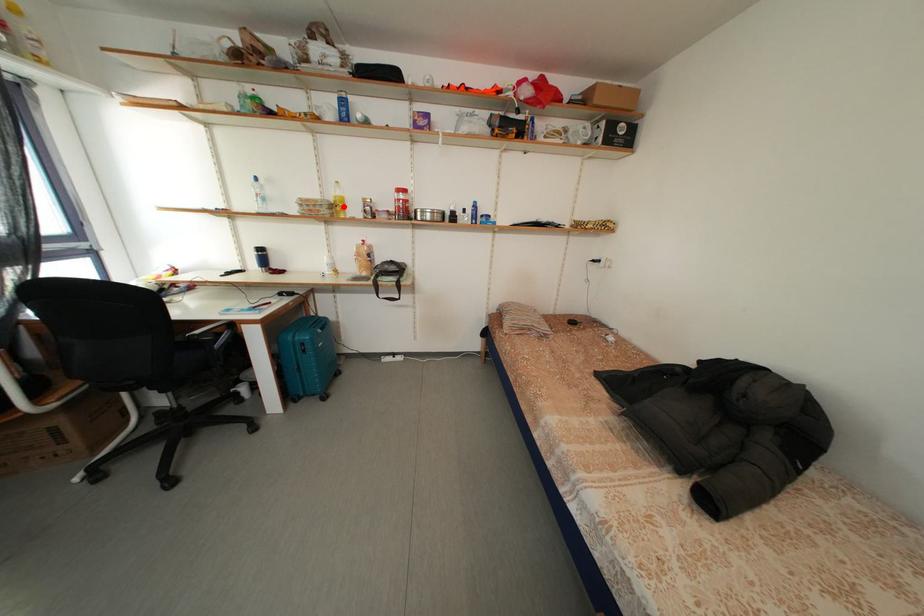
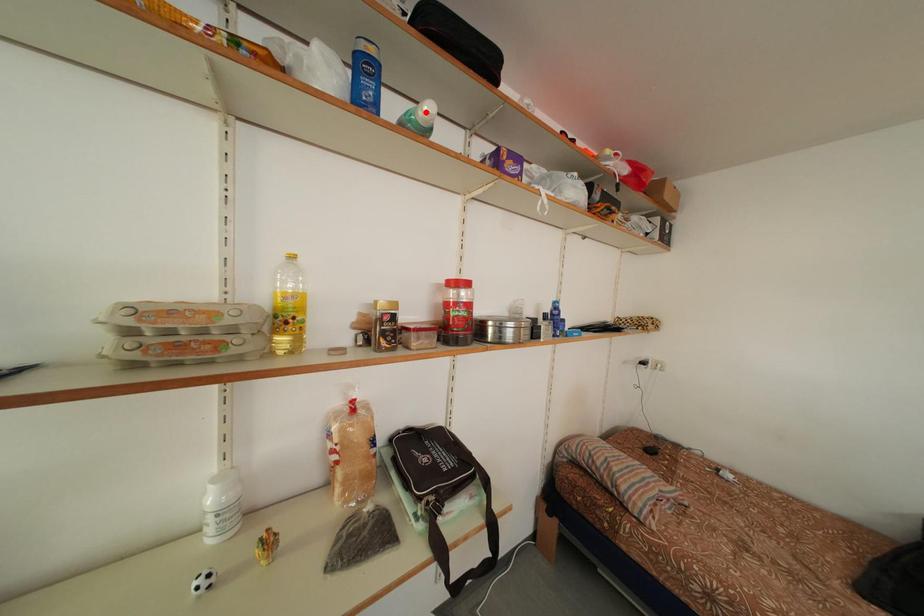
I am providing you with two images of the same scene from different viewpoints. A red point is marked on the first image and another point is marked on the second image. Are the points marked in image1 and image2 representing the same 3D position?

No